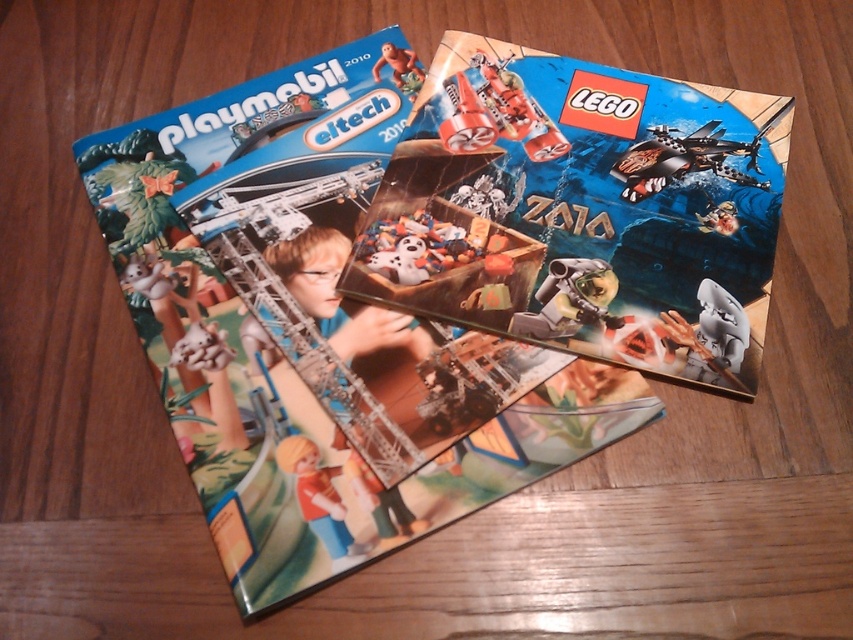
You are looking at the Playmobil and LEGO catalogues from 2010 on the wooden surface. Which of the two points, point (758, 102) or point (705, 378), is closer to you?

Point (758, 102) is further to the camera than point (705, 378), so the point closer to you is point (705, 378).

Consider the image. What is located at the coordinates point (418, 246)?

The point (418, 246) is on the white plush ghost at center.

What is located at the coordinates point (583,211)?

The location at point (583,211) contains a matte plastic lego catalog at center.